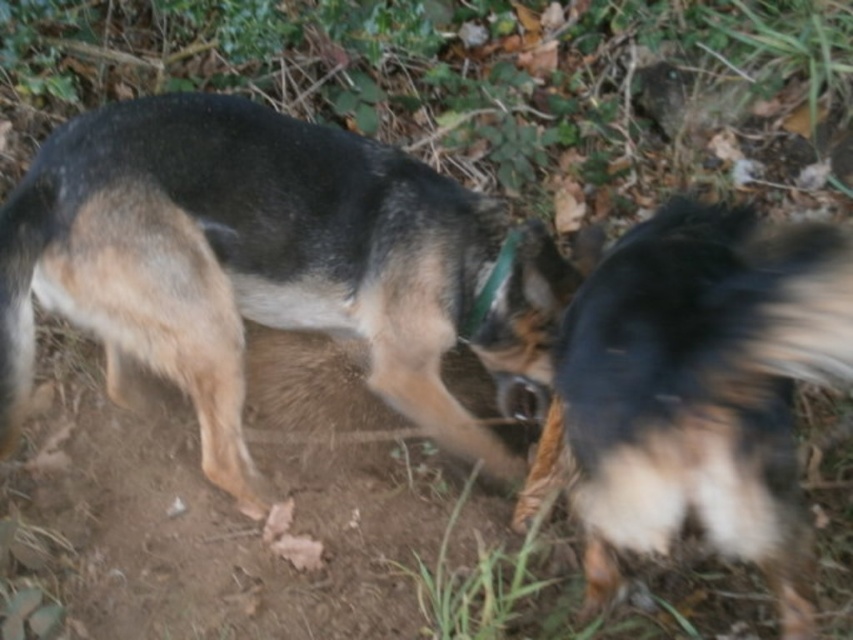
Question: Is black fur dog at center positioned at the back of black fur tail at right?

Choices:
 (A) no
 (B) yes

Answer: (B)

Question: Which of the following is the farthest from the observer?

Choices:
 (A) black fur dog at center
 (B) black fur tail at right

Answer: (A)

Question: Is black fur dog at center wider than black fur tail at right?

Choices:
 (A) no
 (B) yes

Answer: (B)

Question: In this image, where is black fur dog at center located relative to black fur tail at right?

Choices:
 (A) left
 (B) right

Answer: (A)

Question: Which of the following is the closest to the observer?

Choices:
 (A) (650, 230)
 (B) (416, 376)

Answer: (A)